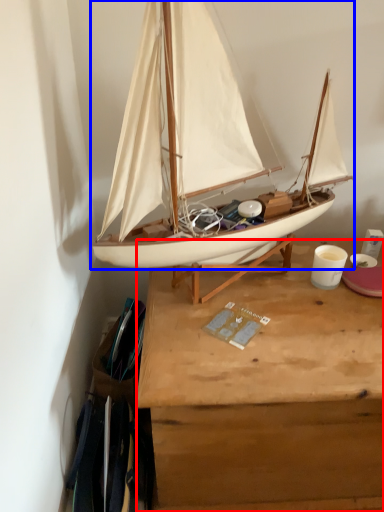
Question: Which of the following is the farthest to the observer, desk (highlighted by a red box) or boat (highlighted by a blue box)?

Choices:
 (A) desk
 (B) boat

Answer: (A)